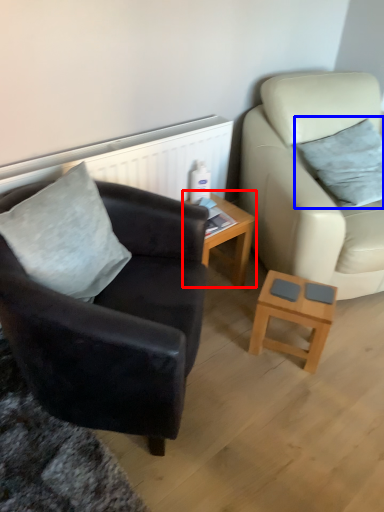
Question: Which point is closer to the camera, table (highlighted by a red box) or pillow (highlighted by a blue box)?

Choices:
 (A) table
 (B) pillow

Answer: (B)